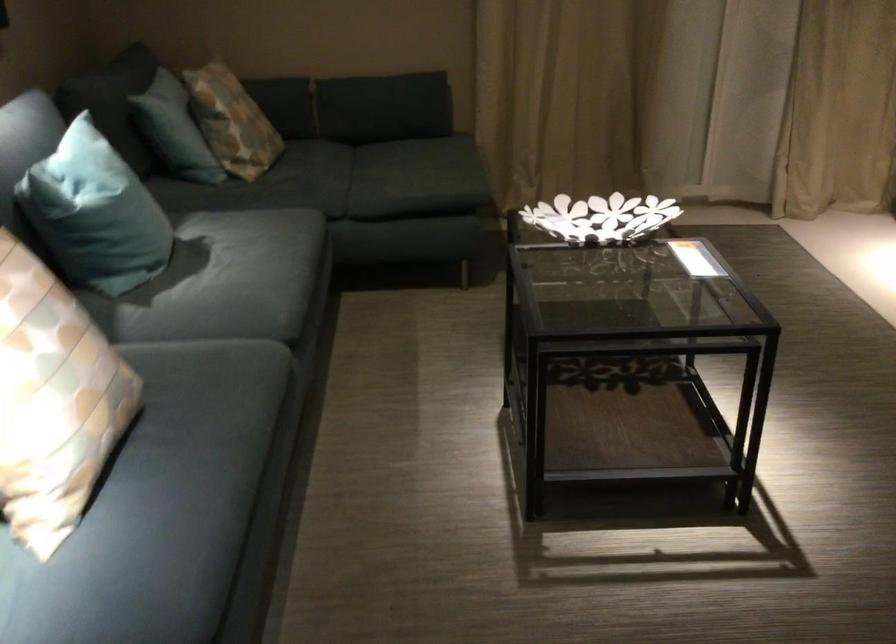
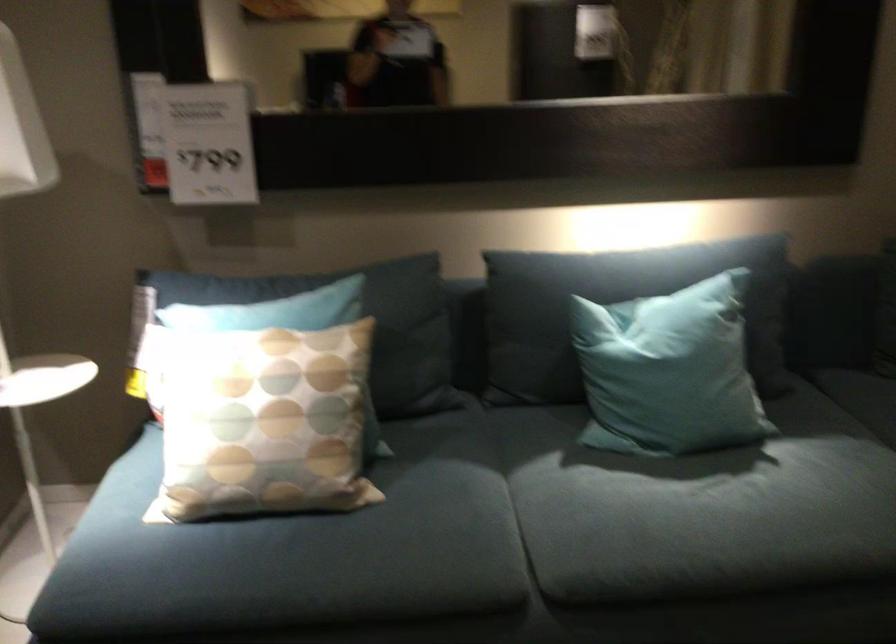
Where in the second image is the point corresponding to (85,357) from the first image?

(263, 422)